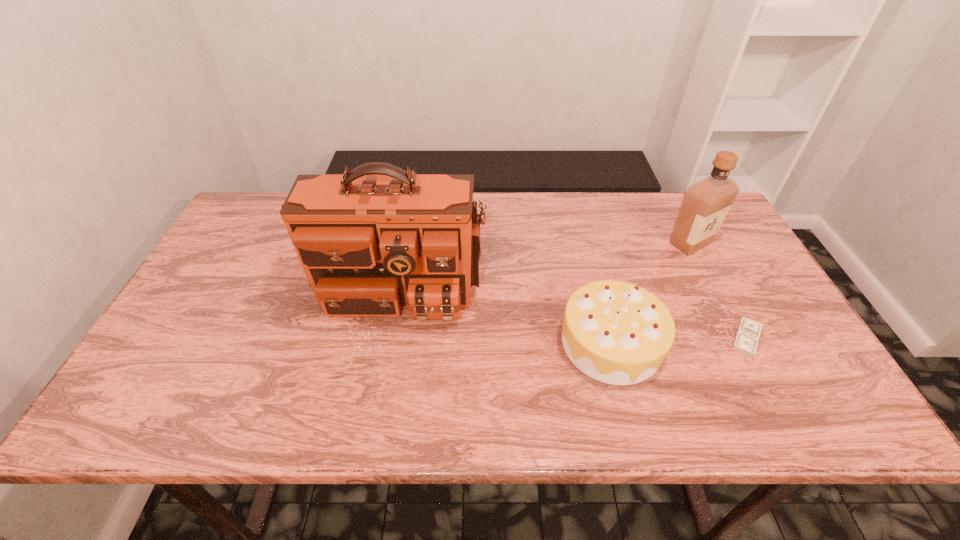
Identify the location of satchel that is at the far edge. Image resolution: width=960 pixels, height=540 pixels. (371, 241).

Image resolution: width=960 pixels, height=540 pixels. I want to click on liquor positioned at the far edge, so click(705, 204).

Where is `liquor present at the right edge`? liquor present at the right edge is located at coordinates (705, 204).

Where is `money present at the right edge`? money present at the right edge is located at coordinates (747, 336).

The width and height of the screenshot is (960, 540). What are the coordinates of `object that is at the far right corner` in the screenshot? It's located at (705, 204).

This screenshot has width=960, height=540. I want to click on free space at the far edge, so click(x=483, y=201).

Find the location of a particular element. This screenshot has height=540, width=960. vacant region at the near edge of the desktop is located at coordinates (582, 408).

The image size is (960, 540). Find the location of `vacant space at the left edge of the desktop`. vacant space at the left edge of the desktop is located at coordinates (217, 301).

This screenshot has height=540, width=960. What are the coordinates of `vacant area at the right edge of the desktop` in the screenshot? It's located at (729, 258).

In the image, there is a desktop. Where is `vacant space at the far left corner`? Image resolution: width=960 pixels, height=540 pixels. vacant space at the far left corner is located at coordinates (268, 231).